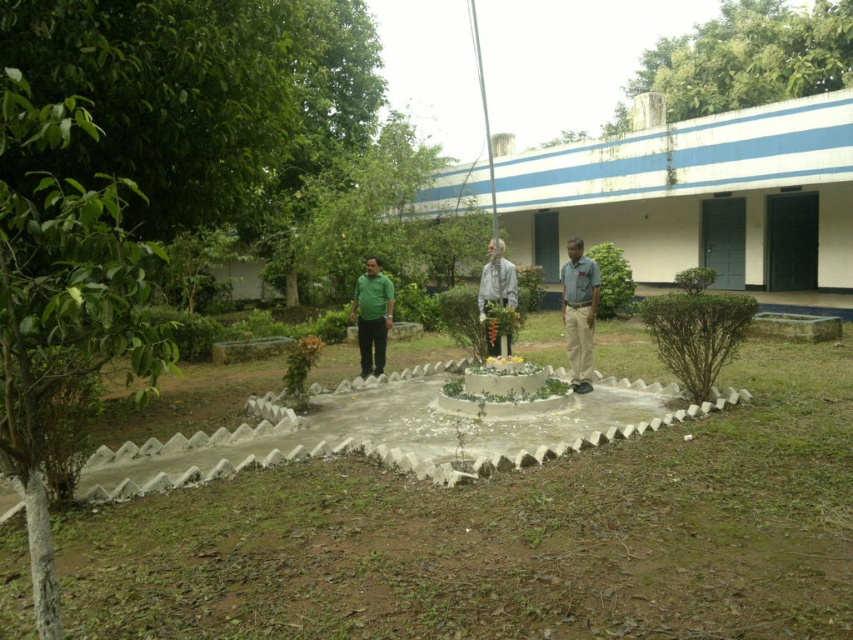
Question: Which point is farther to the camera?

Choices:
 (A) green matte shirt at center
 (B) green leafy tree at upper center
 (C) green leafy tree at left
 (D) gray fabric statue at center

Answer: (B)

Question: Does concrete at center have a larger size compared to green matte shirt at center?

Choices:
 (A) yes
 (B) no

Answer: (B)

Question: Which object appears farthest from the camera in this image?

Choices:
 (A) green matte shirt at center
 (B) blue shirt at center
 (C) green leafy tree at upper center
 (D) gray fabric statue at center

Answer: (C)

Question: Is green leafy tree at left to the right of green leafy tree at upper center from the viewer's perspective?

Choices:
 (A) yes
 (B) no

Answer: (B)

Question: Does green leafy tree at upper center lie behind green matte shirt at center?

Choices:
 (A) no
 (B) yes

Answer: (B)

Question: Which object appears farthest from the camera in this image?

Choices:
 (A) blue shirt at center
 (B) green leafy tree at left

Answer: (A)